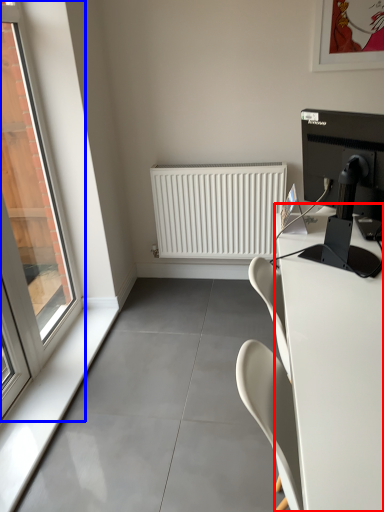
Question: Among these objects, which one is farthest to the camera, desk (highlighted by a red box) or window (highlighted by a blue box)?

Choices:
 (A) desk
 (B) window

Answer: (B)